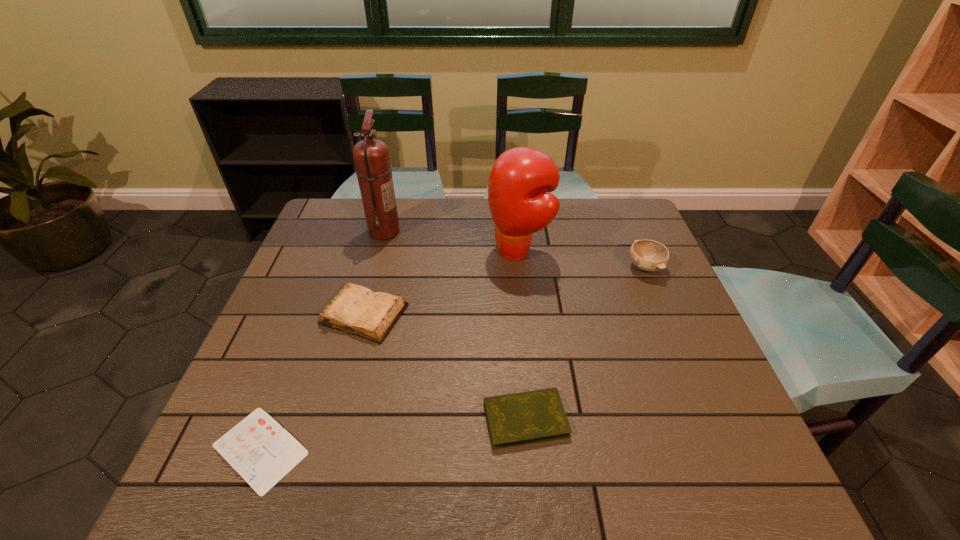
Locate an element on the screen. free space that is in between the second tallest diary and the tallest diary is located at coordinates (445, 367).

Image resolution: width=960 pixels, height=540 pixels. In order to click on vacant point located between the fifth tallest object and the fire extinguisher in this screenshot , I will do `click(455, 325)`.

Locate an element on the screen. vacant region between the fifth tallest object and the third nearest object is located at coordinates (445, 367).

Where is `free spot between the second tallest diary and the bowl`? This screenshot has width=960, height=540. free spot between the second tallest diary and the bowl is located at coordinates (586, 343).

Find the location of a particular element. free space between the fifth tallest object and the shortest diary is located at coordinates (393, 434).

You are a GUI agent. You are given a task and a screenshot of the screen. Output one action in this format:
    pyautogui.click(x=<x>, y=<y>)
    Task: Click on the blank region between the shortest diary and the second shortest diary
    
    Given the screenshot: What is the action you would take?
    pyautogui.click(x=393, y=434)

The image size is (960, 540). I want to click on empty location between the shortest diary and the boxing glove, so click(x=390, y=350).

In order to click on free space between the boxing glove and the fire extinguisher in this screenshot , I will do `click(451, 241)`.

Find the location of a particular element. The width and height of the screenshot is (960, 540). object that stands as the second closest to the shortest object is located at coordinates (517, 419).

Identify which object is the fifth closest to the boxing glove. Please provide its 2D coordinates. Your answer should be formatted as a tuple, i.e. [(x, y)], where the tuple contains the x and y coordinates of a point satisfying the conditions above.

[(262, 452)]